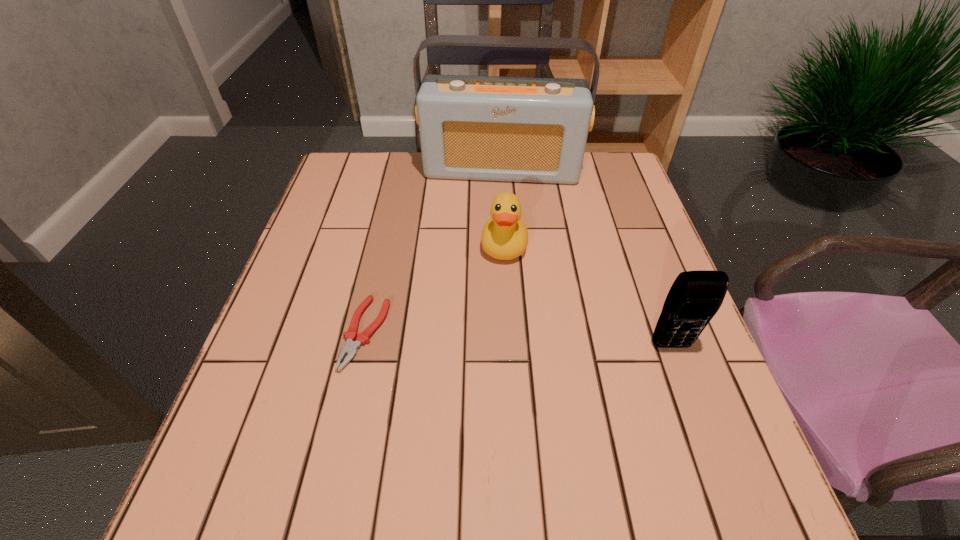
The width and height of the screenshot is (960, 540). Find the location of `vacant spot on the desktop that is between the shortest object and the second tallest object and is positioned at the beak of the second farthest object`. vacant spot on the desktop that is between the shortest object and the second tallest object and is positioned at the beak of the second farthest object is located at coordinates (495, 339).

Find the location of a particular element. The image size is (960, 540). vacant spot on the desktop that is between the leftmost object and the rightmost object and is positioned on the front-facing side of the radio receiver is located at coordinates (490, 338).